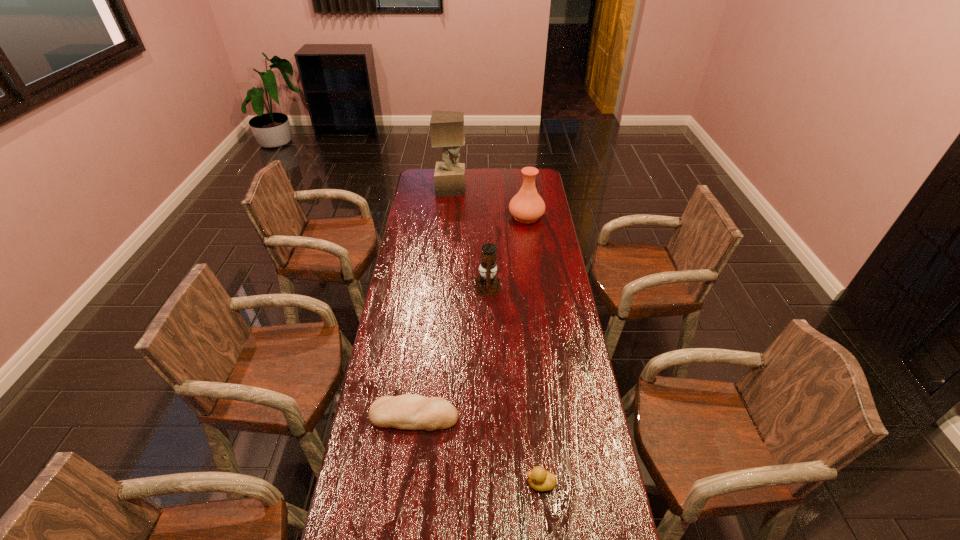
Locate an element on the screen. free spot that satisfies the following two spatial constraints: 1. on the front-facing side of the vase; 2. on the left side of the tallest object is located at coordinates (449, 216).

You are a GUI agent. You are given a task and a screenshot of the screen. Output one action in this format:
    pyautogui.click(x=<x>, y=<y>)
    Task: Click on the vacant space that satisfies the following two spatial constraints: 1. on the front-facing side of the second farthest object; 2. on the left side of the tallest object
    Image resolution: width=960 pixels, height=540 pixels.
    Given the screenshot: What is the action you would take?
    pyautogui.click(x=449, y=216)

At what (x,y) coordinates should I click in order to perform the action: click on free space in the image that satisfies the following two spatial constraints: 1. on the front-facing side of the vase; 2. on the left side of the sculpture. Please return your answer as a coordinate pair (x, y). Looking at the image, I should click on (449, 216).